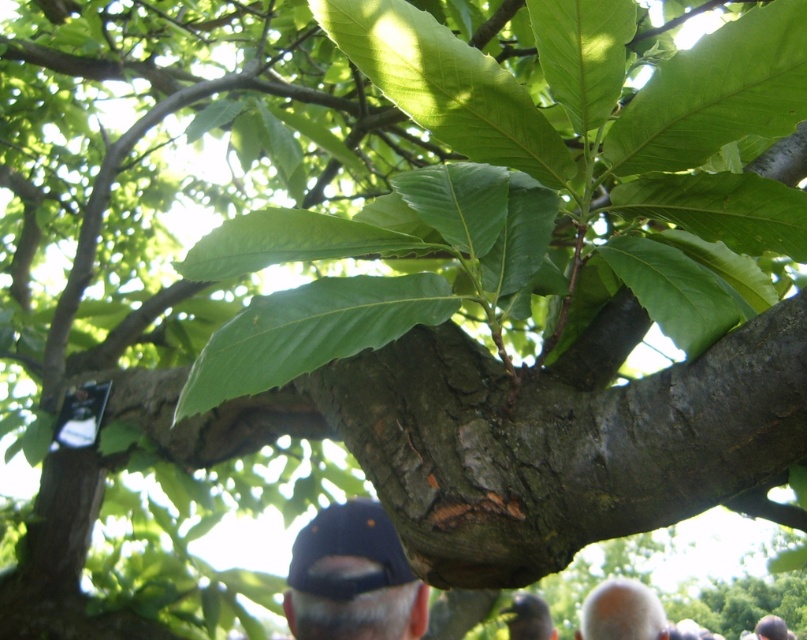
You are a photographer trying to capture both the dark blue fabric baseball cap at lower center and the gray matte cap at upper center in a single frame. Which cap should you focus on to ensure both are in focus, considering their sizes and positions?

The dark blue fabric baseball cap at lower center is smaller than the gray matte cap at upper center. To ensure both are in focus, you should focus on the gray matte cap at upper center since it is larger and positioned closer to the center of the frame, which typically has a deeper depth of field.

You are standing in a park and see a tree branch with vibrant green leaves. There is a dark blue fabric baseball cap at lower center. Where is the point at coordinates point (348, 550) located?

The point at coordinates point (348, 550) is located on the dark blue fabric baseball cap at lower center.